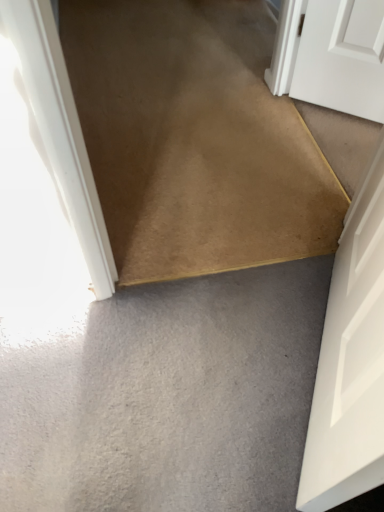
Question: Can you confirm if white matte door at lower right is smaller than gray matte carpet at lower center?

Choices:
 (A) no
 (B) yes

Answer: (A)

Question: From a real-world perspective, does white matte door at lower right sit lower than gray matte carpet at lower center?

Choices:
 (A) no
 (B) yes

Answer: (A)

Question: Is white matte door at lower right not within gray matte carpet at lower center?

Choices:
 (A) no
 (B) yes

Answer: (B)

Question: Considering the relative sizes of white matte door at lower right and gray matte carpet at lower center in the image provided, is white matte door at lower right bigger than gray matte carpet at lower center?

Choices:
 (A) yes
 (B) no

Answer: (A)

Question: Could gray matte carpet at lower center be considered to be inside white matte door at lower right?

Choices:
 (A) no
 (B) yes

Answer: (A)

Question: Relative to gray matte carpet at lower center, is white matte door at lower right in front or behind?

Choices:
 (A) behind
 (B) front

Answer: (B)

Question: Which is correct: white matte door at lower right is inside gray matte carpet at lower center, or outside of it?

Choices:
 (A) inside
 (B) outside

Answer: (B)

Question: Is white matte door at lower right to the left or to the right of gray matte carpet at lower center in the image?

Choices:
 (A) left
 (B) right

Answer: (B)

Question: Looking at their shapes, would you say white matte door at lower right is wider or thinner than gray matte carpet at lower center?

Choices:
 (A) wide
 (B) thin

Answer: (B)

Question: Relative to carpet at center, is gray matte carpet at lower center in front or behind?

Choices:
 (A) front
 (B) behind

Answer: (A)

Question: From the image's perspective, is gray matte carpet at lower center positioned above or below carpet at center?

Choices:
 (A) above
 (B) below

Answer: (B)

Question: In terms of size, does gray matte carpet at lower center appear bigger or smaller than carpet at center?

Choices:
 (A) small
 (B) big

Answer: (A)

Question: Would you say gray matte carpet at lower center is inside or outside carpet at center?

Choices:
 (A) outside
 (B) inside

Answer: (A)

Question: Is gray matte carpet at lower center wider or thinner than white matte door at lower right?

Choices:
 (A) wide
 (B) thin

Answer: (A)

Question: Visually, is gray matte carpet at lower center positioned to the left or to the right of white matte door at lower right?

Choices:
 (A) left
 (B) right

Answer: (A)